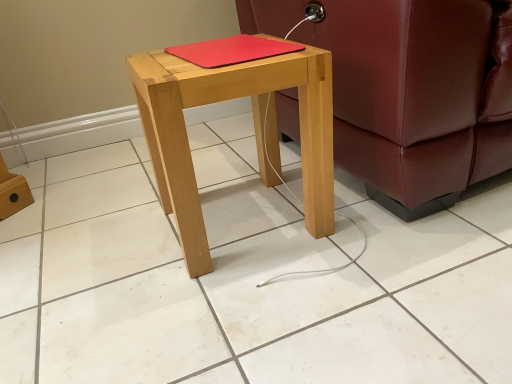
The image size is (512, 384). I want to click on red matte notebook at center, so click(x=232, y=50).

The image size is (512, 384). What are the coordinates of `red matte notebook at center` in the screenshot? It's located at (232, 50).

Is leather couch at right positioned in front of red matte notebook at center?

Yes, it is.

Does leather couch at right turn towards red matte notebook at center?

No.

Can you confirm if leather couch at right is taller than red matte notebook at center?

Yes, leather couch at right is taller than red matte notebook at center.

How different are the orientations of leather couch at right and red matte notebook at center in degrees?

The facing directions of leather couch at right and red matte notebook at center are 0.28 degrees apart.

Measure the distance from red matte notebook at center to natural wood stool at center.

red matte notebook at center and natural wood stool at center are 5.90 inches apart from each other.

Does red matte notebook at center come behind natural wood stool at center?

Yes, it is behind natural wood stool at center.

Find the location of a particular element. The width and height of the screenshot is (512, 384). stool on the left of red matte notebook at center is located at coordinates (254, 127).

Can you confirm if red matte notebook at center is positioned to the left of natural wood stool at center?

Incorrect, red matte notebook at center is not on the left side of natural wood stool at center.

This screenshot has width=512, height=384. Identify the location of stool in front of the red matte notebook at center. (254, 127).

From a real-world perspective, between natural wood stool at center and red matte notebook at center, who is vertically lower?

In real-world perspective, natural wood stool at center is lower.

Based on the photo, is natural wood stool at center facing away from red matte notebook at center?

No, natural wood stool at center is not facing away from red matte notebook at center.

Considering the relative sizes of natural wood stool at center and red matte notebook at center in the image provided, is natural wood stool at center wider than red matte notebook at center?

Yes.

Would you consider red matte notebook at center to be distant from leather couch at right?

No, there isn't a large distance between red matte notebook at center and leather couch at right.

From their relative heights in the image, would you say red matte notebook at center is taller or shorter than leather couch at right?

Clearly, red matte notebook at center is shorter compared to leather couch at right.

Which is less distant, (414, 61) or (317, 158)?

Point (414, 61) is closer to the camera than point (317, 158).

Can you confirm if leather couch at right is thinner than natural wood stool at center?

No, leather couch at right is not thinner than natural wood stool at center.

Is the position of leather couch at right more distant than that of natural wood stool at center?

No, it is in front of natural wood stool at center.

How far apart are natural wood stool at center and leather couch at right?

natural wood stool at center is 24.61 centimeters from leather couch at right.

Considering the sizes of natural wood stool at center and leather couch at right in the image, is natural wood stool at center taller or shorter than leather couch at right?

natural wood stool at center is shorter than leather couch at right.

Is natural wood stool at center wider or thinner than leather couch at right?

In the image, natural wood stool at center appears to be more narrow than leather couch at right.

Is natural wood stool at center at the right side of leather couch at right?

No.

Find the location of a particular element. The height and width of the screenshot is (384, 512). studio couch in front of the red matte notebook at center is located at coordinates (419, 95).

Where is `notebook lying on the right of natural wood stool at center`? Image resolution: width=512 pixels, height=384 pixels. notebook lying on the right of natural wood stool at center is located at coordinates (232, 50).

Which object lies further to the anchor point red matte notebook at center, leather couch at right or natural wood stool at center?

Among the two, leather couch at right is located further to red matte notebook at center.

Based on their spatial positions, is red matte notebook at center or leather couch at right further from natural wood stool at center?

The object further to natural wood stool at center is leather couch at right.

Based on the photo, looking at the image, which one is located further to leather couch at right, natural wood stool at center or red matte notebook at center?

red matte notebook at center.

Considering their positions, is natural wood stool at center positioned further to red matte notebook at center than leather couch at right?

leather couch at right.

From the image, which object appears to be nearer to natural wood stool at center, leather couch at right or red matte notebook at center?

Among the two, red matte notebook at center is located nearer to natural wood stool at center.

Estimate the real-world distances between objects in this image. Which object is further from leather couch at right, red matte notebook at center or natural wood stool at center?

red matte notebook at center lies further to leather couch at right than the other object.

Locate an element on the screen. notebook between natural wood stool at center and leather couch at right from left to right is located at coordinates (232, 50).